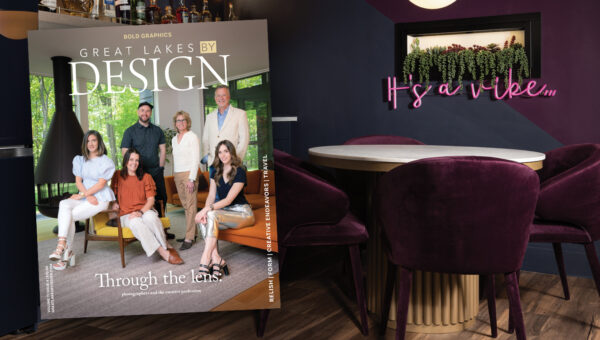
Where is `grey floor`? The height and width of the screenshot is (340, 600). grey floor is located at coordinates (98, 302).